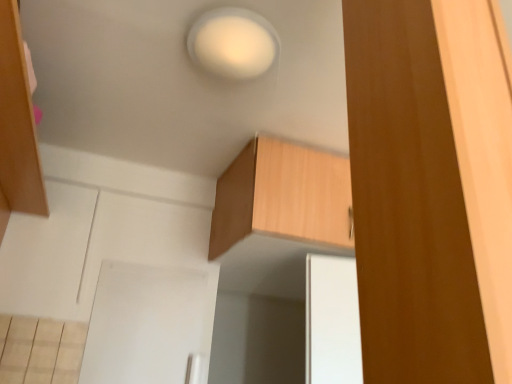
Question: Considering the positions of point (252, 23) and point (394, 114), is point (252, 23) closer or farther from the camera than point (394, 114)?

Choices:
 (A) closer
 (B) farther

Answer: (B)

Question: Is white matte light at upper center wider or thinner than brown wood cabinet at right, which is the 2th cabinetry in back-to-front order?

Choices:
 (A) thin
 (B) wide

Answer: (B)

Question: Which is farther from the wooden cabinet at upper center, which appears as the second cabinetry when viewed from the front?

Choices:
 (A) white matte light at upper center
 (B) brown wood cabinet at right, which is the 2th cabinetry in back-to-front order

Answer: (B)

Question: Which object is the farthest from the wooden cabinet at upper center, which appears as the second cabinetry when viewed from the front?

Choices:
 (A) white matte light at upper center
 (B) brown wood cabinet at right, the 1th cabinetry from the front

Answer: (B)